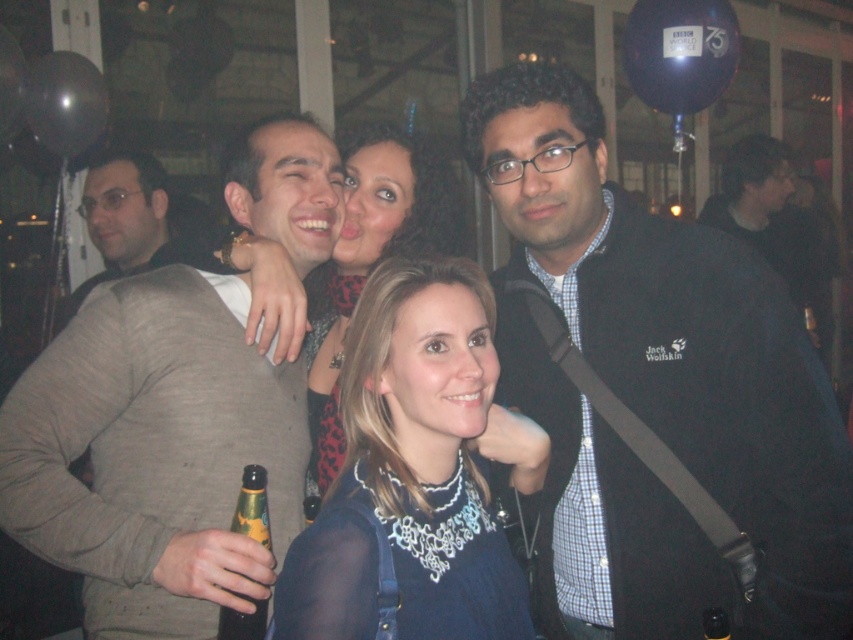
Question: Which point is closer to the camera?

Choices:
 (A) black jack wolfskin jacket at center
 (B) matte blue dress at center
 (C) gray sweater at center

Answer: (B)

Question: Can you confirm if black jack wolfskin jacket at center is smaller than green glass bottle at lower left?

Choices:
 (A) yes
 (B) no

Answer: (B)

Question: Is black jack wolfskin jacket at center below gray sweater at center?

Choices:
 (A) yes
 (B) no

Answer: (A)

Question: Does matte black hair at center have a larger size compared to gray sweater at left?

Choices:
 (A) no
 (B) yes

Answer: (A)

Question: Based on their relative distances, which object is farther from the green glass bottle at lower left?

Choices:
 (A) matte black hair at center
 (B) gray sweater at center

Answer: (A)

Question: Which object is closer to the camera taking this photo?

Choices:
 (A) matte blue dress at center
 (B) black jack wolfskin jacket at center
 (C) gray sweater at left
 (D) gray sweater at center

Answer: (A)